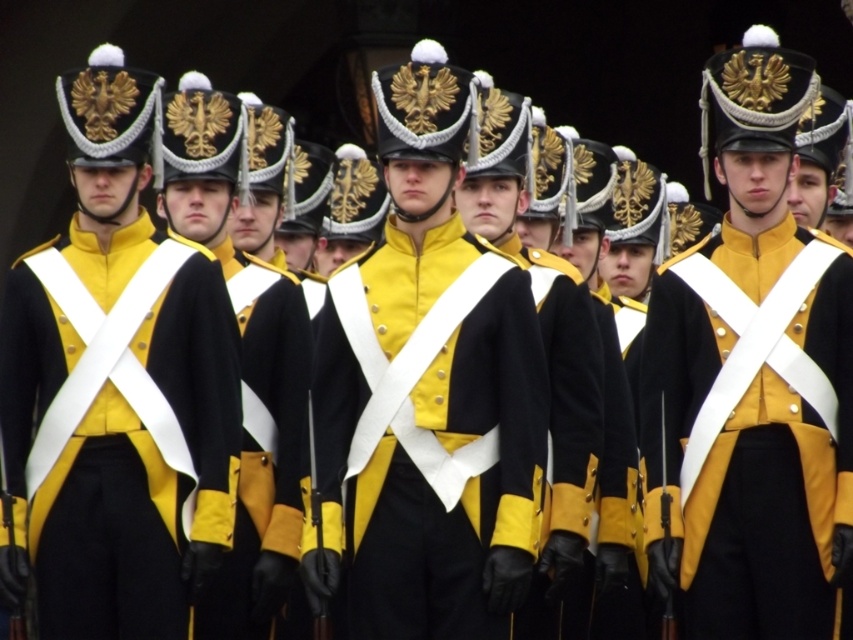
Question: Which point is farther to the camera?

Choices:
 (A) black wool coat at center
 (B) yellow matte fabric coat at center
 (C) black matte uniform at center

Answer: (A)

Question: Which point appears farthest from the camera in this image?

Choices:
 (A) (343, 518)
 (B) (111, 596)
 (C) (260, 522)

Answer: (C)

Question: Considering the real-world distances, which object is farthest from the black wool coat at center?

Choices:
 (A) black matte uniform at center
 (B) yellow matte uniform at center
 (C) yellow matte fabric coat at center

Answer: (B)

Question: Does yellow matte fabric coat at center lie in front of black wool coat at center?

Choices:
 (A) yes
 (B) no

Answer: (A)

Question: Can you confirm if yellow matte uniform at center is smaller than black wool coat at center?

Choices:
 (A) yes
 (B) no

Answer: (B)

Question: Can you confirm if black matte uniform at center is positioned to the right of black wool coat at center?

Choices:
 (A) no
 (B) yes

Answer: (B)